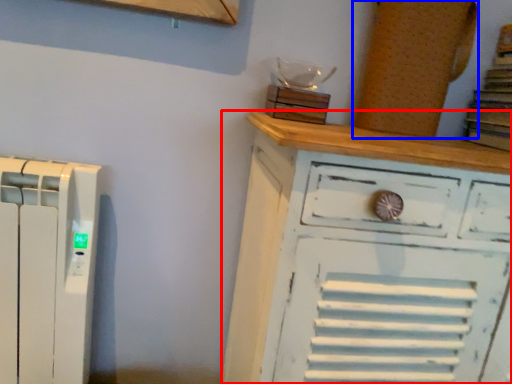
Question: Among these objects, which one is farthest to the camera, chest of drawers (highlighted by a red box) or wood (highlighted by a blue box)?

Choices:
 (A) chest of drawers
 (B) wood

Answer: (B)